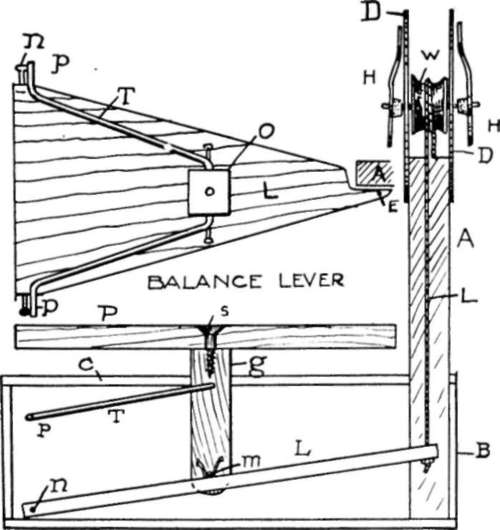
This screenshot has width=500, height=530. What are the coordinates of `latch` in the screenshot? It's located at (222, 199).